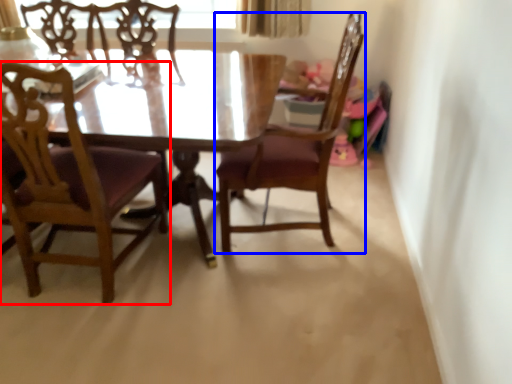
Question: Which object is closer to the camera taking this photo, chair (highlighted by a red box) or chair (highlighted by a blue box)?

Choices:
 (A) chair
 (B) chair

Answer: (A)